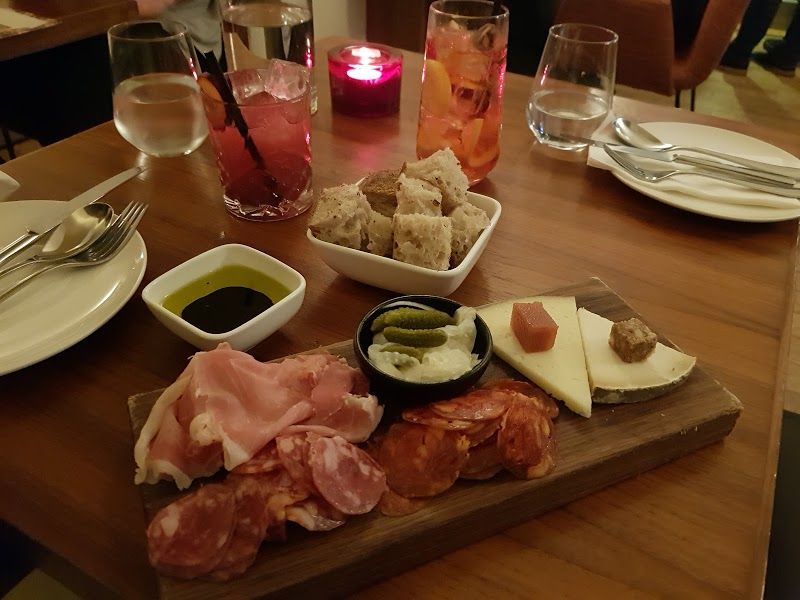
The width and height of the screenshot is (800, 600). I want to click on spoon, so click(x=630, y=126), click(x=74, y=232).